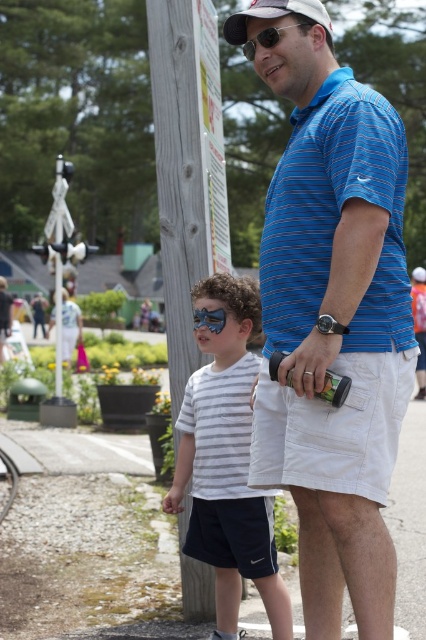
Is point (219, 579) positioned behind point (183, 385)?

No, it is in front of (183, 385).

Does point (212, 378) come behind point (178, 74)?

No, it is in front of (178, 74).

Locate an element on the screen. Image resolution: width=426 pixels, height=640 pixels. white striped shirt at center is located at coordinates (227, 461).

Is point (249, 28) farther from camera compared to point (226, 301)?

No, it is not.

Who is positioned more to the right, blue striped polo shirt at center or white striped shirt at center?

From the viewer's perspective, blue striped polo shirt at center appears more on the right side.

Is point (354, 129) farther from camera compared to point (230, 289)?

No, it is not.

Find the location of a particular element. blue striped polo shirt at center is located at coordinates (334, 328).

Which is behind, point (244, 26) or point (204, 314)?

Positioned behind is point (204, 314).

Between white fabric baseball cap at upper center and blue reflective goggles at center, which one is positioned higher?

white fabric baseball cap at upper center

Between point (238, 42) and point (221, 323), which one is positioned behind?

Point (221, 323)

Locate an element on the screen. The height and width of the screenshot is (640, 426). white fabric baseball cap at upper center is located at coordinates click(x=273, y=16).